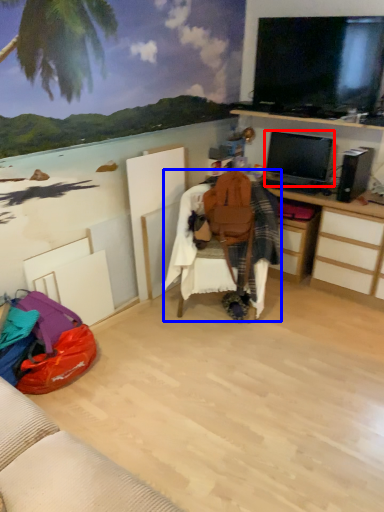
Question: Among these objects, which one is nearest to the camera, television (highlighted by a red box) or bean bag chair (highlighted by a blue box)?

Choices:
 (A) television
 (B) bean bag chair

Answer: (B)